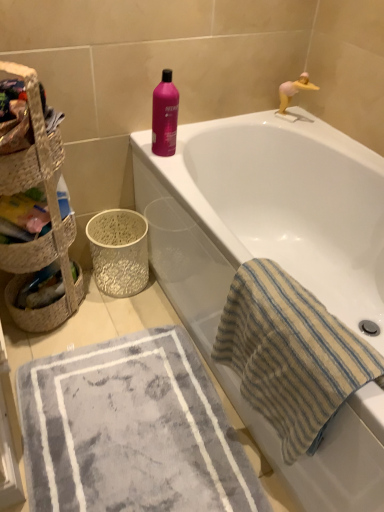
The image size is (384, 512). I want to click on vacant point to the left of pink plastic toy at upper right, so click(x=267, y=118).